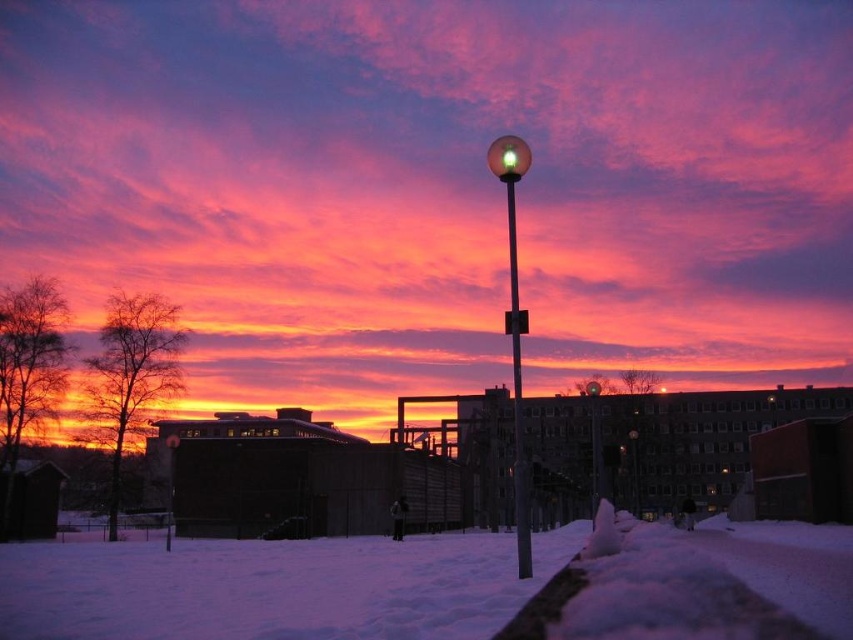
Which is in front, point (593, 381) or point (775, 401)?

Positioned in front is point (593, 381).

Does point (596, 396) come farther from viewer compared to point (764, 397)?

No, (596, 396) is closer to viewer.

Describe the element at coordinates (595, 444) in the screenshot. I see `glossy glass sphere at center` at that location.

You are a GUI agent. You are given a task and a screenshot of the screen. Output one action in this format:
    pyautogui.click(x=<x>, y=<y>)
    Task: Click on the glossy glass sphere at center
    
    Given the screenshot: What is the action you would take?
    pyautogui.click(x=595, y=444)

Between point (596, 461) and point (631, 472), which one is positioned in front?

Positioned in front is point (596, 461).

Find the location of a particular element. glossy glass sphere at center is located at coordinates pyautogui.click(x=595, y=444).

Where is `glossy glass sphere at center`? The image size is (853, 640). glossy glass sphere at center is located at coordinates (595, 444).

Who is positioned more to the right, translucent glass globe at center or glossy glass sphere at center?

glossy glass sphere at center

Does translucent glass globe at center appear on the right side of glossy glass sphere at center?

Incorrect, translucent glass globe at center is not on the right side of glossy glass sphere at center.

Measure the distance between translucent glass globe at center and camera.

17.09 meters

Identify the location of translucent glass globe at center. This screenshot has width=853, height=640. (514, 330).